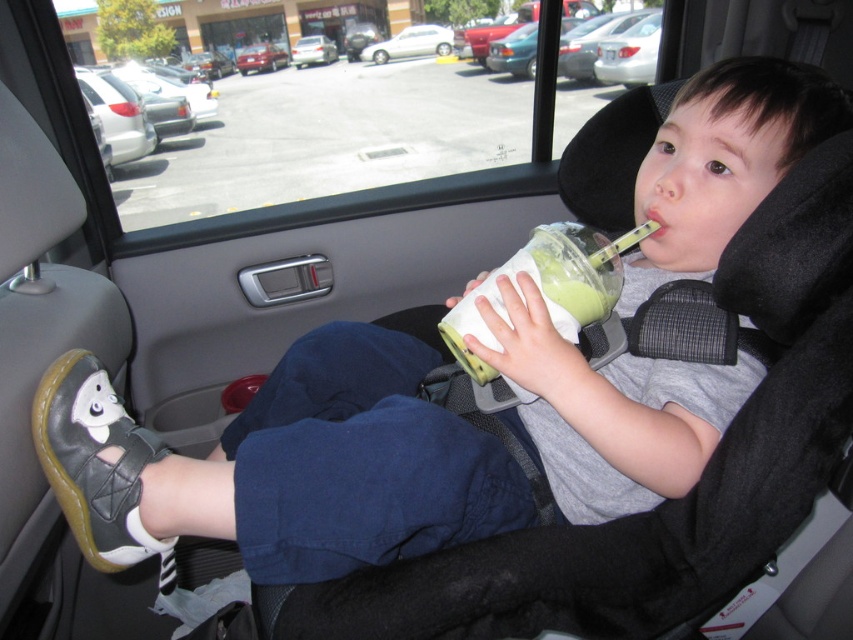
You are a parent checking the backseat of your car. You see a metallic red car at center and a white plastic car at center. Which toy car is more to the left?

The metallic red car at center is positioned on the left side of white plastic car at center, so the metallic red car at center is more to the left.

You are a parent trying to choose between two toy cars for your child. The white matte car at center and the white plastic car at center are both in the cup holder. Which one takes up more vertical space?

The white matte car at center is taller than the white plastic car at center, so it takes up more vertical space.